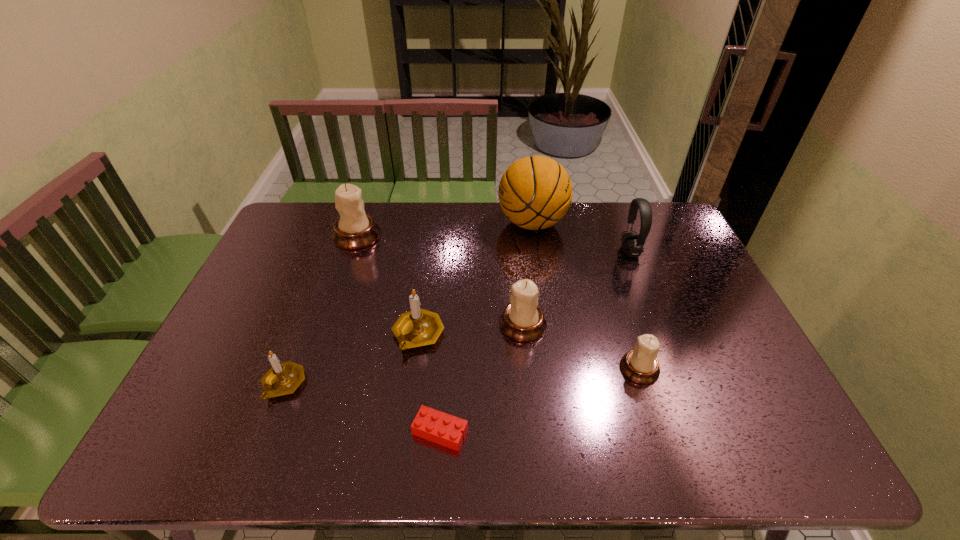
The image size is (960, 540). Find the location of `orange basketball`. orange basketball is located at coordinates (535, 192).

What are the coordinates of `basketball` in the screenshot? It's located at coord(535,192).

Locate an element on the screen. The height and width of the screenshot is (540, 960). the farthest candle holder is located at coordinates [354, 229].

Identify the location of the leftmost white candle holder. (354, 229).

This screenshot has width=960, height=540. Find the location of `the rightmost object`. the rightmost object is located at coordinates (632, 244).

Locate an element on the screen. Image resolution: width=960 pixels, height=540 pixels. the second nearest white candle holder is located at coordinates (523, 320).

Where is `the second candle holder from right to left`? The height and width of the screenshot is (540, 960). the second candle holder from right to left is located at coordinates (523, 320).

Where is `the third candle holder from right to left`? This screenshot has width=960, height=540. the third candle holder from right to left is located at coordinates (419, 327).

At what (x,y) coordinates should I click in order to perform the action: click on the right gold candle holder. Please return your answer as a coordinate pair (x, y). Looking at the image, I should click on (419, 327).

Identify the location of the smallest white candle holder. This screenshot has height=540, width=960. (640, 365).